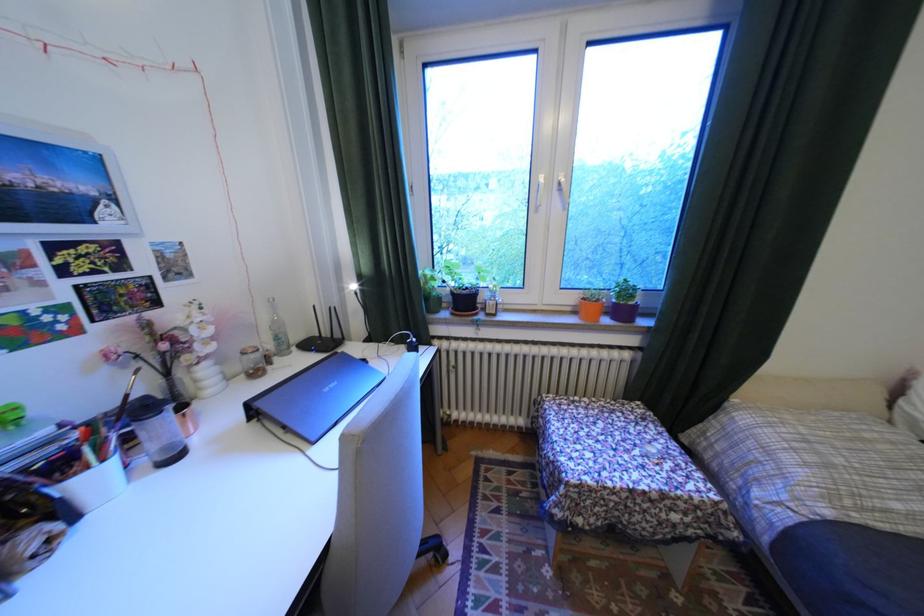
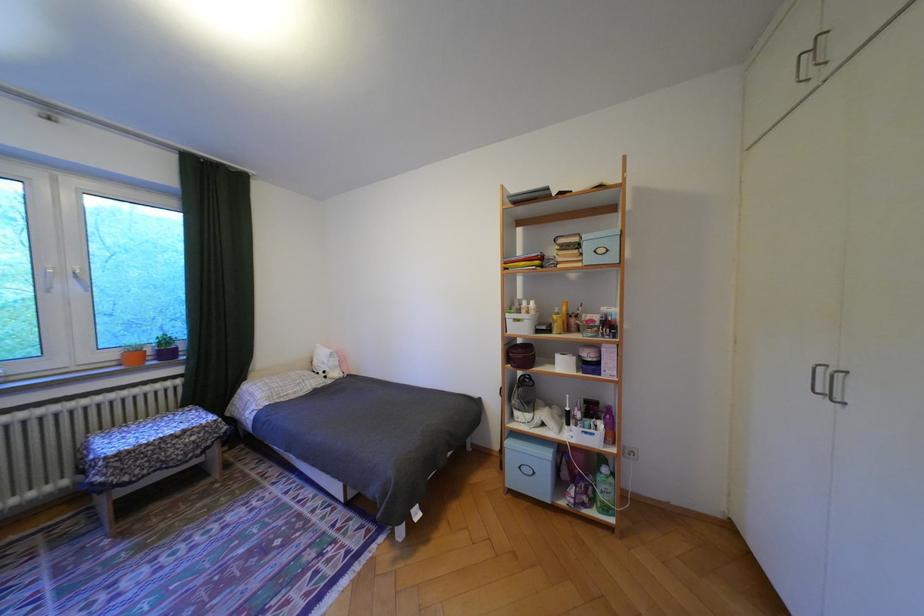
Where in the second image is the point corresponding to point 566,195 from the first image?

(84, 280)